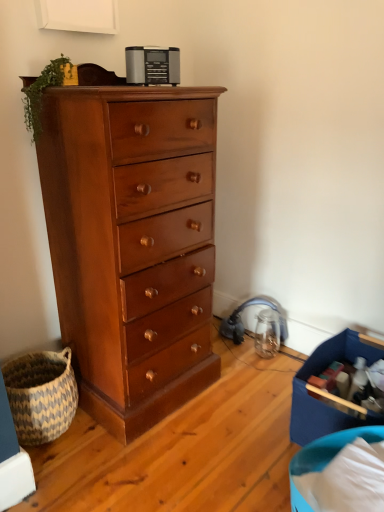
Measure the distance between point (362, 345) and camera.

Point (362, 345) is 1.70 meters from camera.

The height and width of the screenshot is (512, 384). What do you see at coordinates (317, 399) in the screenshot?
I see `blue fabric storage box at lower right` at bounding box center [317, 399].

At what (x,y) coordinates should I click in order to perform the action: click on shiny brown wood chest of drawers at left. Please return your answer as a coordinate pair (x, y). This screenshot has height=512, width=384. Looking at the image, I should click on (132, 244).

Measure the distance between shiny brown wood chest of drawers at left and camera.

The distance of shiny brown wood chest of drawers at left from camera is 1.11 meters.

The image size is (384, 512). What do you see at coordinates (41, 394) in the screenshot?
I see `natural woven basket at lower left` at bounding box center [41, 394].

In order to face natural woven basket at lower left, should I rotate leftwards or rightwards?

You should rotate left by 19.970 degrees.

This screenshot has width=384, height=512. In order to click on blue fabric storage box at lower right in this screenshot , I will do [x=317, y=399].

Can you confirm if blue fabric storage box at lower right is thinner than natural woven basket at lower left?

No, blue fabric storage box at lower right is not thinner than natural woven basket at lower left.

Where is `storage box that appears on the right of natural woven basket at lower left`? The height and width of the screenshot is (512, 384). storage box that appears on the right of natural woven basket at lower left is located at coordinates (317, 399).

From a real-world perspective, is blue fabric storage box at lower right under natural woven basket at lower left?

No.

What's the angular difference between blue fabric storage box at lower right and natural woven basket at lower left's facing directions?

81.7 degrees.

From the image's perspective, relative to satin silver radio at upper center, is natural woven basket at lower left above or below?

Clearly, from the image's perspective, natural woven basket at lower left is below satin silver radio at upper center.

Is natural woven basket at lower left positioned in front of satin silver radio at upper center?

Yes, natural woven basket at lower left is in front of satin silver radio at upper center.

How many degrees apart are the facing directions of natural woven basket at lower left and satin silver radio at upper center?

natural woven basket at lower left and satin silver radio at upper center are facing 22.4 degrees away from each other.

Is blue fabric storage box at lower right oriented towards shiny brown wood chest of drawers at left?

No, blue fabric storage box at lower right is not facing towards shiny brown wood chest of drawers at left.

Can you confirm if blue fabric storage box at lower right is shorter than shiny brown wood chest of drawers at left?

Correct, blue fabric storage box at lower right is not as tall as shiny brown wood chest of drawers at left.

Is blue fabric storage box at lower right not inside shiny brown wood chest of drawers at left?

Yes, blue fabric storage box at lower right is not within shiny brown wood chest of drawers at left.

Which object is further away from the camera taking this photo, satin silver radio at upper center or natural woven basket at lower left?

satin silver radio at upper center is behind.

Which of these two, satin silver radio at upper center or natural woven basket at lower left, stands taller?

natural woven basket at lower left.

From a real-world perspective, is satin silver radio at upper center over natural woven basket at lower left?

Indeed, from a real-world perspective, satin silver radio at upper center stands above natural woven basket at lower left.

Are satin silver radio at upper center and natural woven basket at lower left far apart?

Yes, satin silver radio at upper center and natural woven basket at lower left are located far from each other.

From the image's perspective, would you say blue fabric storage box at lower right is shown under satin silver radio at upper center?

Yes, from the image's perspective, blue fabric storage box at lower right is beneath satin silver radio at upper center.

Is blue fabric storage box at lower right touching satin silver radio at upper center?

They are not placed beside each other.

Do you think blue fabric storage box at lower right is within satin silver radio at upper center, or outside of it?

blue fabric storage box at lower right is not enclosed by satin silver radio at upper center.

Measure the distance between blue fabric storage box at lower right and satin silver radio at upper center.

blue fabric storage box at lower right is 3.97 feet away from satin silver radio at upper center.

Is natural woven basket at lower left not within shiny brown wood chest of drawers at left?

natural woven basket at lower left lies outside shiny brown wood chest of drawers at left's area.

Which is in front, natural woven basket at lower left or shiny brown wood chest of drawers at left?

shiny brown wood chest of drawers at left is closer to the camera.

Would you consider natural woven basket at lower left to be distant from shiny brown wood chest of drawers at left?

That's not correct — natural woven basket at lower left is a little close to shiny brown wood chest of drawers at left.

From a real-world perspective, which is physically below, natural woven basket at lower left or blue fabric storage box at lower right?

natural woven basket at lower left is physically lower.

Is natural woven basket at lower left outside of blue fabric storage box at lower right?

Yes.

From the image's perspective, between natural woven basket at lower left and blue fabric storage box at lower right, who is located below?

natural woven basket at lower left.

How much distance is there between natural woven basket at lower left and blue fabric storage box at lower right?

35.77 inches.

Where is `basket on the left of blue fabric storage box at lower right`? This screenshot has width=384, height=512. basket on the left of blue fabric storage box at lower right is located at coordinates (41, 394).

The width and height of the screenshot is (384, 512). Identify the location of basket in front of the satin silver radio at upper center. (41, 394).

When comparing their distances from satin silver radio at upper center, does blue fabric storage box at lower right or shiny brown wood chest of drawers at left seem further?

blue fabric storage box at lower right.

Looking at the image, which one is located further to natural woven basket at lower left, blue fabric storage box at lower right or satin silver radio at upper center?

satin silver radio at upper center is positioned further to the anchor natural woven basket at lower left.

Estimate the real-world distances between objects in this image. Which object is closer to blue fabric storage box at lower right, natural woven basket at lower left or satin silver radio at upper center?

natural woven basket at lower left lies closer to blue fabric storage box at lower right than the other object.

Considering their positions, is natural woven basket at lower left positioned closer to blue fabric storage box at lower right than shiny brown wood chest of drawers at left?

Among the two, shiny brown wood chest of drawers at left is located nearer to blue fabric storage box at lower right.

Looking at this image, from the image, which object appears to be nearer to natural woven basket at lower left, blue fabric storage box at lower right or shiny brown wood chest of drawers at left?

shiny brown wood chest of drawers at left is closer to natural woven basket at lower left.

Estimate the real-world distances between objects in this image. Which object is further from natural woven basket at lower left, shiny brown wood chest of drawers at left or satin silver radio at upper center?

satin silver radio at upper center is positioned further to the anchor natural woven basket at lower left.

Based on their spatial positions, is satin silver radio at upper center or blue fabric storage box at lower right closer to shiny brown wood chest of drawers at left?

satin silver radio at upper center lies closer to shiny brown wood chest of drawers at left than the other object.

In the scene shown: When comparing their distances from blue fabric storage box at lower right, does satin silver radio at upper center or natural woven basket at lower left seem closer?

natural woven basket at lower left is positioned closer to the anchor blue fabric storage box at lower right.

Where is `the chest of drawers between satin silver radio at upper center and natural woven basket at lower left vertically`? The image size is (384, 512). the chest of drawers between satin silver radio at upper center and natural woven basket at lower left vertically is located at coordinates pos(132,244).

You are a GUI agent. You are given a task and a screenshot of the screen. Output one action in this format:
    pyautogui.click(x=<x>, y=<y>)
    Task: Click on the chest of drawers between satin silver radio at upper center and blue fabric storage box at lower right in the vertical direction
    
    Given the screenshot: What is the action you would take?
    (x=132, y=244)

The height and width of the screenshot is (512, 384). I want to click on storage box between satin silver radio at upper center and natural woven basket at lower left in the vertical direction, so click(317, 399).

In order to click on chest of drawers between natural woven basket at lower left and blue fabric storage box at lower right from left to right in this screenshot , I will do `click(132, 244)`.